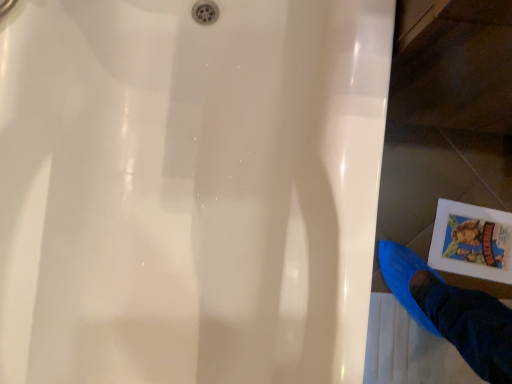
Question: In terms of height, does white paper comic book at lower right look taller or shorter compared to blue fabric foot at lower right?

Choices:
 (A) tall
 (B) short

Answer: (A)

Question: Is white paper comic book at lower right inside the boundaries of blue fabric foot at lower right, or outside?

Choices:
 (A) inside
 (B) outside

Answer: (B)

Question: Based on their sizes in the image, would you say white paper comic book at lower right is bigger or smaller than blue fabric foot at lower right?

Choices:
 (A) big
 (B) small

Answer: (B)

Question: From a real-world perspective, is blue fabric foot at lower right above or below white paper comic book at lower right?

Choices:
 (A) below
 (B) above

Answer: (B)

Question: In the image, is blue fabric foot at lower right on the left side or the right side of white paper comic book at lower right?

Choices:
 (A) right
 (B) left

Answer: (B)

Question: From their relative heights in the image, would you say blue fabric foot at lower right is taller or shorter than white paper comic book at lower right?

Choices:
 (A) tall
 (B) short

Answer: (B)

Question: Considering their positions, is blue fabric foot at lower right located in front of or behind white paper comic book at lower right?

Choices:
 (A) front
 (B) behind

Answer: (A)